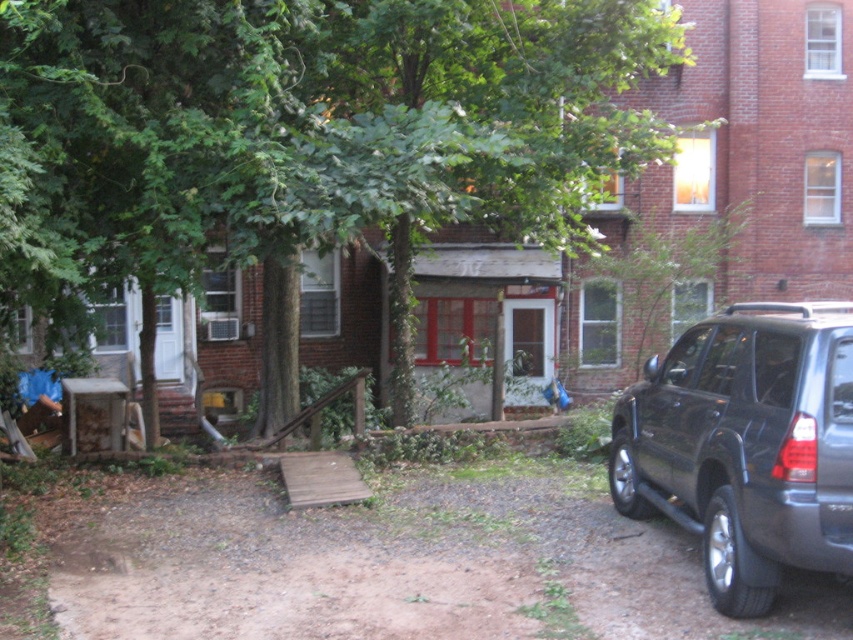
Can you confirm if green leafy tree at center is positioned below shiny dark gray suv at right?

Actually, green leafy tree at center is above shiny dark gray suv at right.

Does green leafy tree at center appear over shiny dark gray suv at right?

Indeed, green leafy tree at center is positioned over shiny dark gray suv at right.

The height and width of the screenshot is (640, 853). I want to click on green leafy tree at center, so click(x=309, y=131).

This screenshot has width=853, height=640. In order to click on green leafy tree at center in this screenshot , I will do `click(309, 131)`.

Which is more to the right, brown gravel driveway at lower right or shiny dark gray suv at right?

shiny dark gray suv at right

Which of these two, brown gravel driveway at lower right or shiny dark gray suv at right, stands shorter?

With less height is brown gravel driveway at lower right.

Which is behind, point (294, 618) or point (656, 387)?

Positioned behind is point (656, 387).

I want to click on brown gravel driveway at lower right, so click(x=403, y=564).

From the picture: Is green leafy tree at center to the right of brown gravel driveway at lower right from the viewer's perspective?

Incorrect, green leafy tree at center is not on the right side of brown gravel driveway at lower right.

Consider the image. Does green leafy tree at center have a smaller size compared to brown gravel driveway at lower right?

Indeed, green leafy tree at center has a smaller size compared to brown gravel driveway at lower right.

Does point (28, 188) come in front of point (169, 624)?

No.

The width and height of the screenshot is (853, 640). I want to click on green leafy tree at center, so click(309, 131).